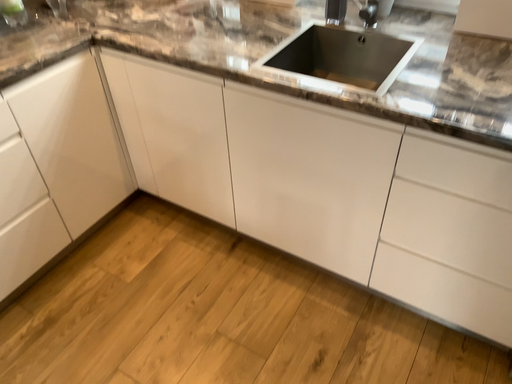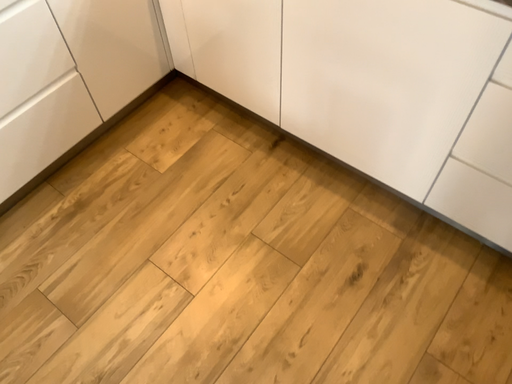
Question: How did the camera likely rotate when shooting the video?

Choices:
 (A) rotated upward
 (B) rotated downward

Answer: (B)